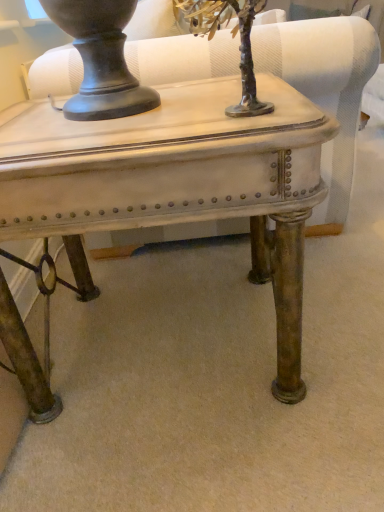
The height and width of the screenshot is (512, 384). I want to click on vacant space situated above matte white table at center (from a real-world perspective), so click(139, 111).